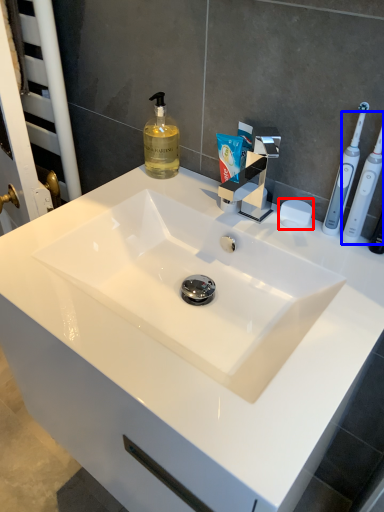
Question: Which of the following is the farthest to the observer, soap (highlighted by a red box) or toothbrush (highlighted by a blue box)?

Choices:
 (A) soap
 (B) toothbrush

Answer: (A)